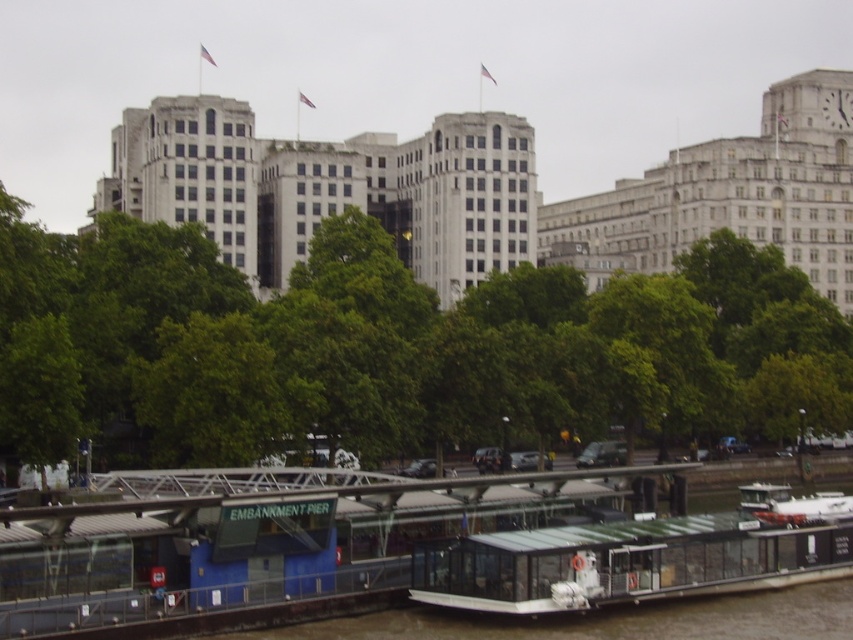
You are a tourist standing on the EMBANKMENT PIER and want to take a photo of the transparent glass boat at center without the green leafy tree at center blocking the view. How should you adjust your position?

The green leafy tree at center is positioned over the transparent glass boat at center. To avoid the tree blocking the view, move to a position where the tree is no longer directly above the boat, such as behind the tree or to the side of the tree where the branches do not obstruct the boat.

You are a photographer trying to capture both the green leafy tree at center and the transparent glass boat at center in a single frame. Based on their widths, which object might require you to adjust your camera angle to ensure both fit in the shot?

The green leafy tree at center might be wider than the transparent glass boat at center, so you might need to adjust your camera angle to accommodate its width to include both in the frame.